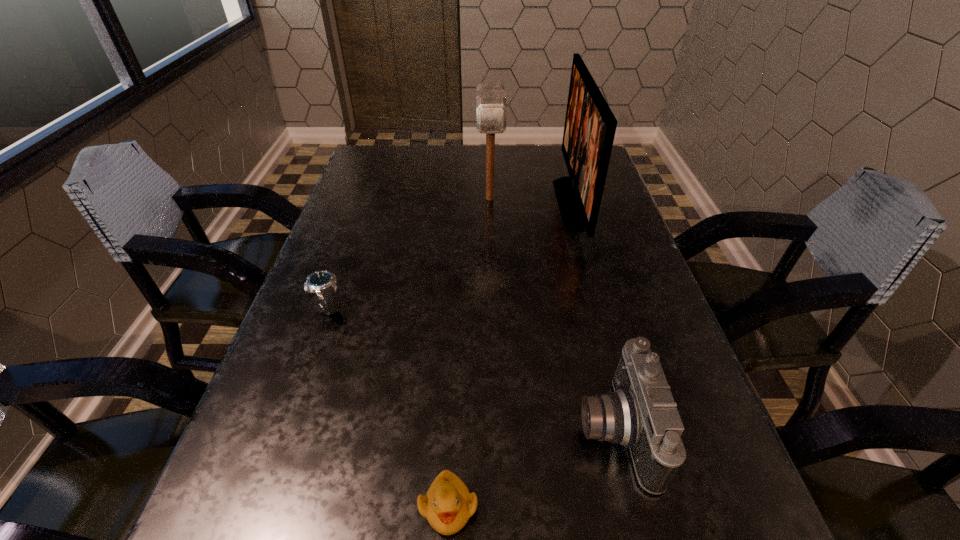
Locate an element on the screen. blank area located on the front-facing side of the third shortest object is located at coordinates (331, 430).

At what (x,y) coordinates should I click in order to perform the action: click on vacant space located on the front-facing side of the third shortest object. Please return your answer as a coordinate pair (x, y). This screenshot has width=960, height=540. Looking at the image, I should click on (449, 430).

At what (x,y) coordinates should I click in order to perform the action: click on free location located 0.080m on the front-facing side of the third shortest object. Please return your answer as a coordinate pair (x, y). The image size is (960, 540). Looking at the image, I should click on (530, 430).

The height and width of the screenshot is (540, 960). Find the location of `blank space located 0.170m on the back of the watch`. blank space located 0.170m on the back of the watch is located at coordinates (351, 244).

Where is `object that is positioned at the far edge`? object that is positioned at the far edge is located at coordinates (590, 126).

You are a GUI agent. You are given a task and a screenshot of the screen. Output one action in this format:
    pyautogui.click(x=<x>, y=<y>)
    Task: Click on the object positioned at the left edge
    Image resolution: width=960 pixels, height=540 pixels.
    Given the screenshot: What is the action you would take?
    pyautogui.click(x=323, y=283)

Where is `monitor positioned at the right edge`? The image size is (960, 540). monitor positioned at the right edge is located at coordinates (590, 126).

Image resolution: width=960 pixels, height=540 pixels. Find the location of `camera at the right edge`. camera at the right edge is located at coordinates (641, 414).

At what (x,y) coordinates should I click in order to perform the action: click on object positioned at the far right corner. Please return your answer as a coordinate pair (x, y). This screenshot has width=960, height=540. Looking at the image, I should click on (590, 126).

Find the location of `vacant region at the far edge of the desktop`. vacant region at the far edge of the desktop is located at coordinates (530, 168).